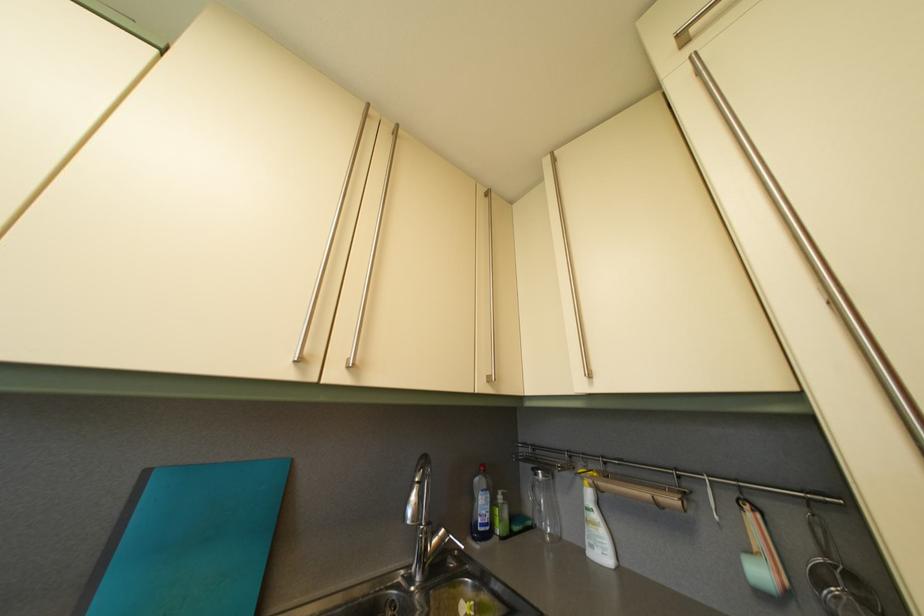
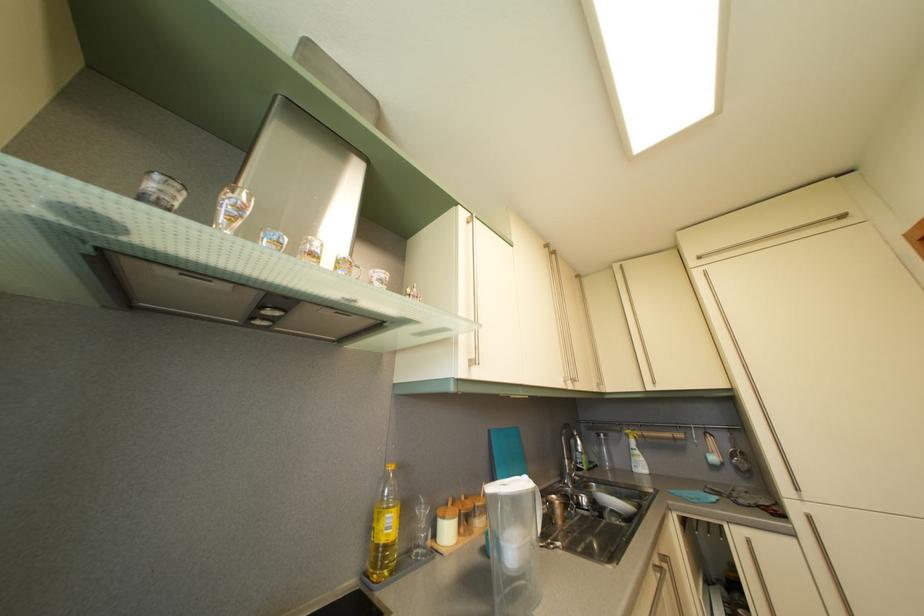
Find the pixel in the second image that matches [154,480] in the first image.

(497, 439)